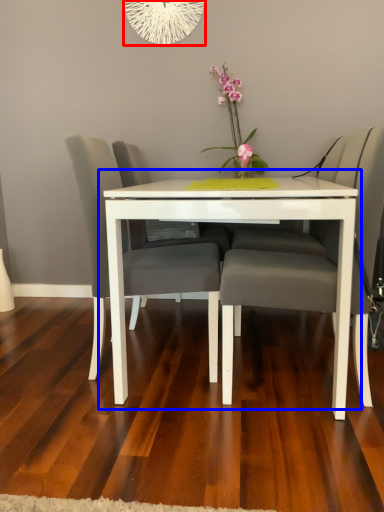
Question: Which of the following is the closest to the observer, oval (highlighted by a red box) or table (highlighted by a blue box)?

Choices:
 (A) oval
 (B) table

Answer: (B)